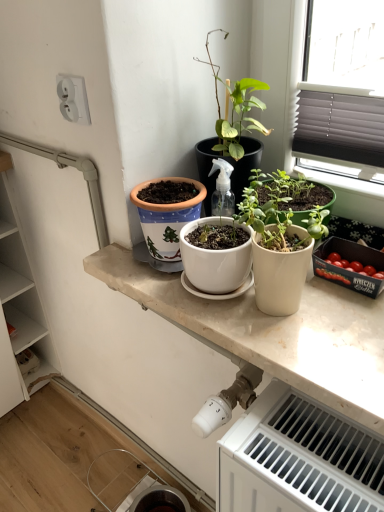
This screenshot has height=512, width=384. In order to click on free space to the left of terracotta clay pot at center in this screenshot , I will do `click(117, 263)`.